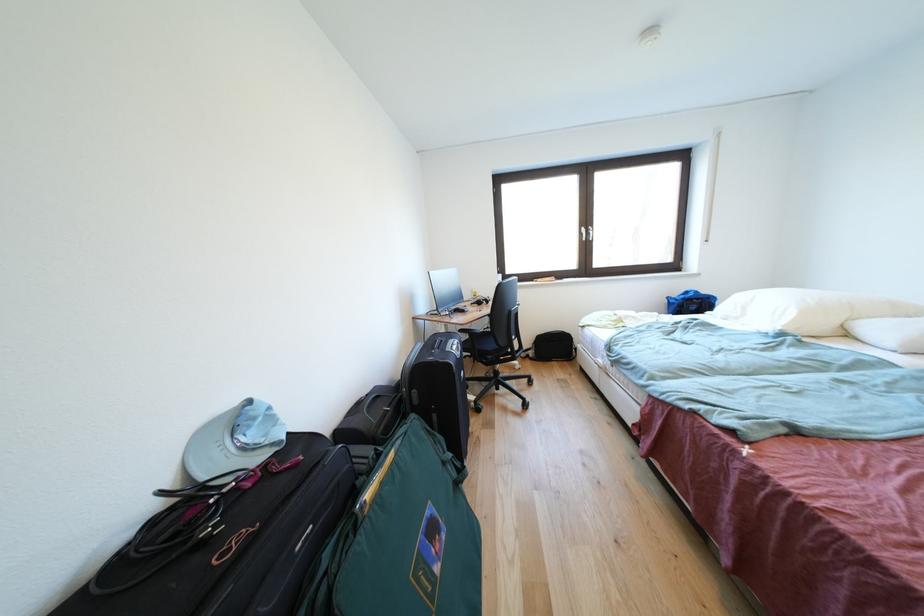
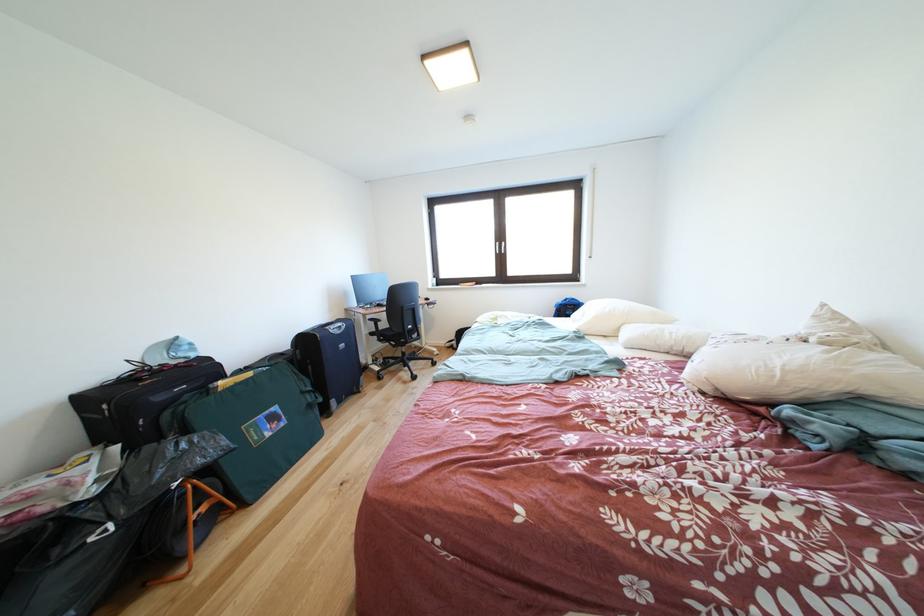
Which direction would the cameraman need to move to produce the second image?

The movement direction of the cameraman is right, backward.